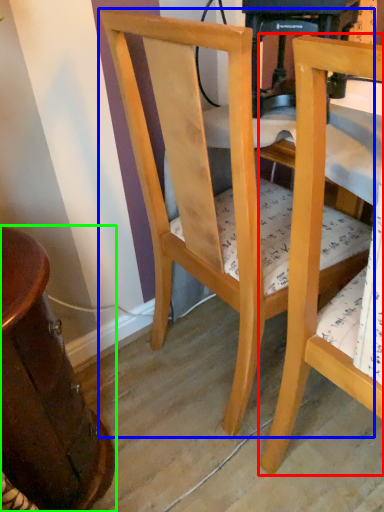
Question: Estimate the real-world distances between objects in this image. Which object is farther from chair (highlighted by a red box), chair (highlighted by a blue box) or table (highlighted by a green box)?

Choices:
 (A) chair
 (B) table

Answer: (B)